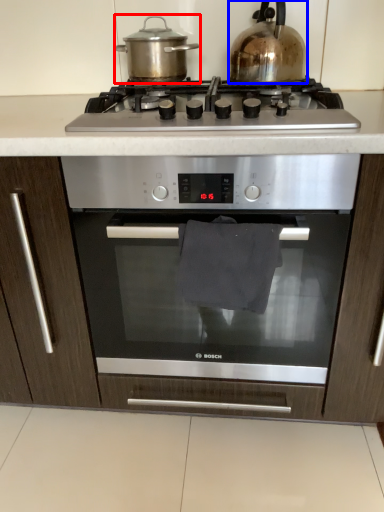
Question: Which object appears farthest to the camera in this image, kitchen appliance (highlighted by a red box) or kitchen appliance (highlighted by a blue box)?

Choices:
 (A) kitchen appliance
 (B) kitchen appliance

Answer: (A)